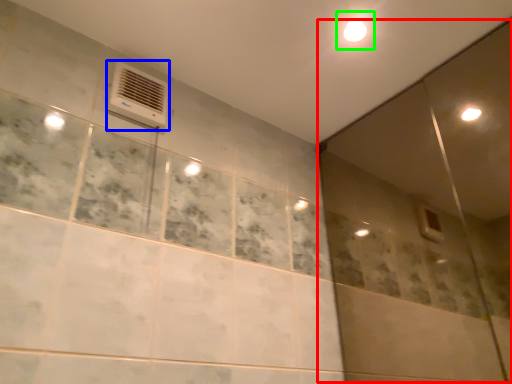
Question: Considering the real-world distances, which object is farthest from screen door (highlighted by a red box)? air conditioning (highlighted by a blue box) or light (highlighted by a green box)?

Choices:
 (A) air conditioning
 (B) light

Answer: (A)